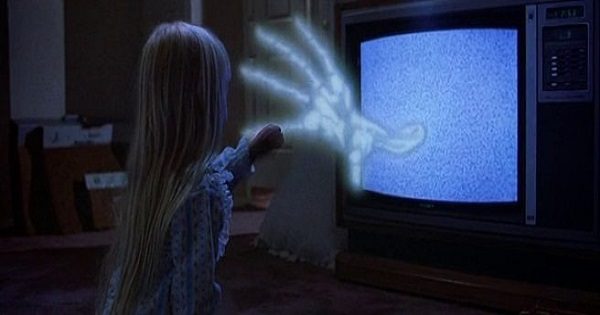
Image resolution: width=600 pixels, height=315 pixels. I want to click on white wooden door, so click(x=269, y=10).